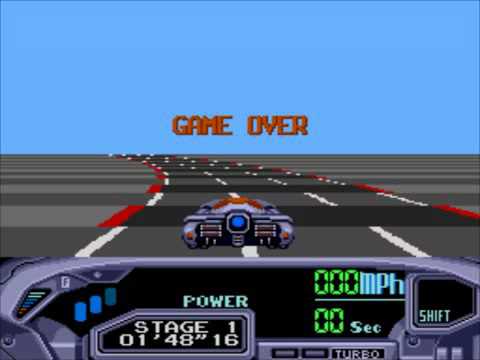
Where is `vent`? This screenshot has height=360, width=480. vent is located at coordinates (32, 300).